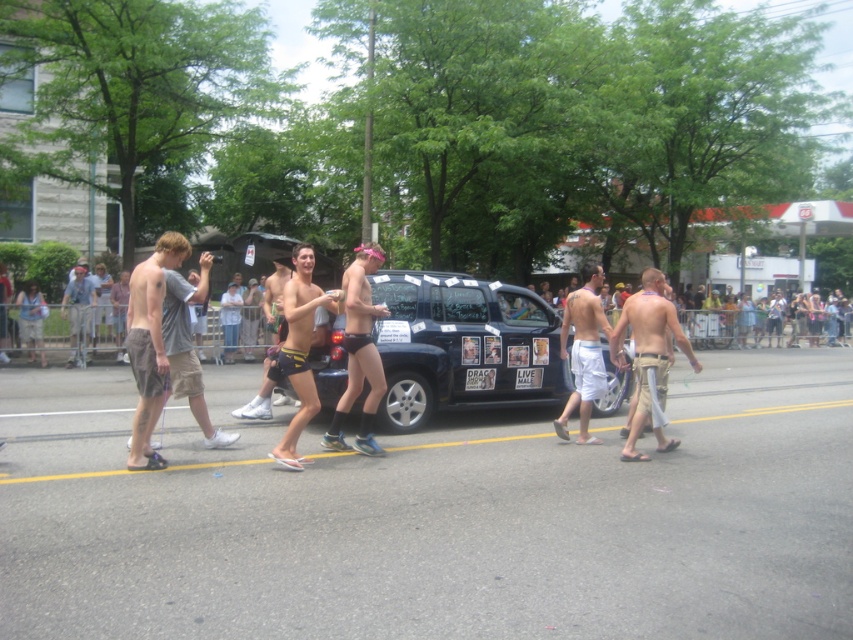
You are a participant in the parade and want to read both the white plastic sign at center and the white paper sign at center. Which sign should you look at first to read the one that is nearer to you?

The white plastic sign at center is closer to the viewer than the white paper sign at center, so you should look at the white plastic sign at center first.

You are a photographer standing at the edge of the street, wanting to capture both the white cotton shorts at center and the light blue denim shorts at left in a single frame. Given that your camera has a maximum horizontal field of view of 30 feet, will you be able to include both subjects in the photo?

The white cotton shorts at center and light blue denim shorts at left are 33.25 feet apart. Since the distance between them exceeds the camera field of view of 30 feet, you won both subjects in the photo.